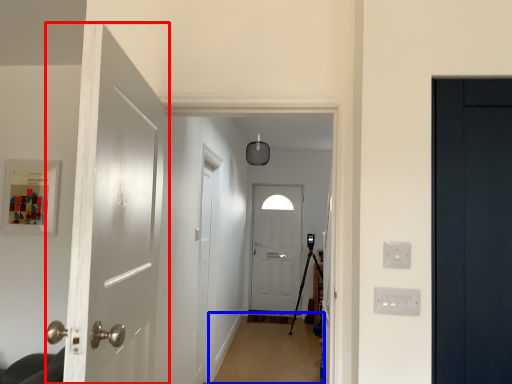
Question: Among these objects, which one is nearest to the camera, door (highlighted by a red box) or plain (highlighted by a blue box)?

Choices:
 (A) door
 (B) plain

Answer: (A)